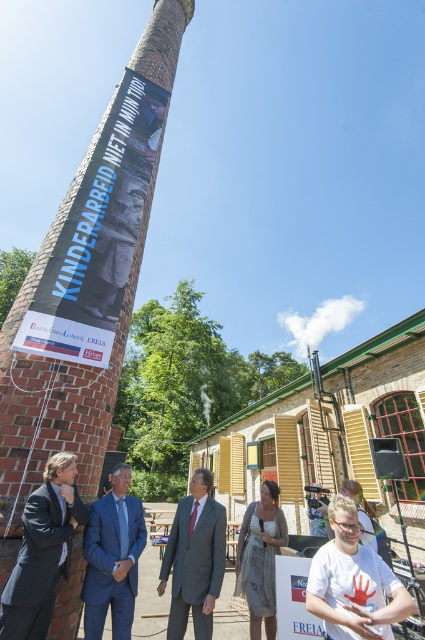
Question: Is white cotton t-shirt at lower right further to the viewer compared to white paper at lower right?

Choices:
 (A) no
 (B) yes

Answer: (A)

Question: Which of the following is the farthest from the observer?

Choices:
 (A) white cotton t-shirt at lower right
 (B) white paper at lower right
 (C) dark gray wool suit at lower left

Answer: (B)

Question: Where is matte black banner at upper left located in relation to dark gray wool suit at lower left in the image?

Choices:
 (A) left
 (B) right

Answer: (A)

Question: Does brick chimney at center come in front of matte gray suit at center?

Choices:
 (A) yes
 (B) no

Answer: (A)

Question: Among these objects, which one is nearest to the camera?

Choices:
 (A) white cotton t-shirt at lower right
 (B) brick chimney at center

Answer: (A)

Question: Which point is farther to the camera?

Choices:
 (A) (48, 284)
 (B) (30, 364)
 (C) (59, 531)
 (D) (125, 508)

Answer: (A)